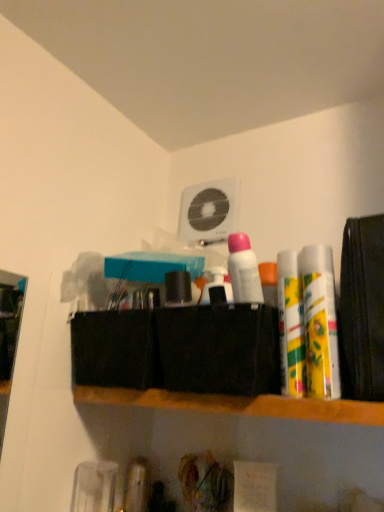
Question: Is white matte deodorant at center, acting as the first toiletry starting from the left, outside of wooden shelf at center?

Choices:
 (A) yes
 (B) no

Answer: (A)

Question: From the image's perspective, is white matte deodorant at center, placed as the 3th toiletry when sorted from right to left, located above wooden shelf at center?

Choices:
 (A) yes
 (B) no

Answer: (A)

Question: Considering the relative sizes of white matte deodorant at center, placed as the 3th toiletry when sorted from right to left, and wooden shelf at center in the image provided, is white matte deodorant at center, placed as the 3th toiletry when sorted from right to left, shorter than wooden shelf at center?

Choices:
 (A) no
 (B) yes

Answer: (A)

Question: Is the position of white matte deodorant at center, acting as the first toiletry starting from the left, more distant than that of wooden shelf at center?

Choices:
 (A) no
 (B) yes

Answer: (B)

Question: Can you confirm if white matte deodorant at center, acting as the first toiletry starting from the left, is taller than wooden shelf at center?

Choices:
 (A) no
 (B) yes

Answer: (B)

Question: Is white matte deodorant at center, placed as the 3th toiletry when sorted from right to left, wider or thinner than wooden shelf at center?

Choices:
 (A) thin
 (B) wide

Answer: (A)

Question: Would you say white matte deodorant at center, placed as the 3th toiletry when sorted from right to left, is to the left or to the right of wooden shelf at center in the picture?

Choices:
 (A) left
 (B) right

Answer: (B)

Question: Looking at the image, does white matte deodorant at center, placed as the 3th toiletry when sorted from right to left, seem bigger or smaller compared to wooden shelf at center?

Choices:
 (A) small
 (B) big

Answer: (A)

Question: From the image's perspective, relative to wooden shelf at center, is white matte deodorant at center, placed as the 3th toiletry when sorted from right to left, above or below?

Choices:
 (A) below
 (B) above

Answer: (B)

Question: From their relative heights in the image, would you say white plastic fan at upper center is taller or shorter than wooden shelf at center?

Choices:
 (A) tall
 (B) short

Answer: (A)

Question: Relative to wooden shelf at center, is white plastic fan at upper center in front or behind?

Choices:
 (A) front
 (B) behind

Answer: (B)

Question: From a real-world perspective, is white plastic fan at upper center above or below wooden shelf at center?

Choices:
 (A) above
 (B) below

Answer: (A)

Question: From the image's perspective, is white plastic fan at upper center positioned above or below wooden shelf at center?

Choices:
 (A) below
 (B) above

Answer: (B)

Question: From the image's perspective, relative to white matte deodorant at center, acting as the first toiletry starting from the left, is wooden shelf at center above or below?

Choices:
 (A) below
 (B) above

Answer: (A)

Question: Is wooden shelf at center taller or shorter than white matte deodorant at center, placed as the 3th toiletry when sorted from right to left?

Choices:
 (A) tall
 (B) short

Answer: (B)